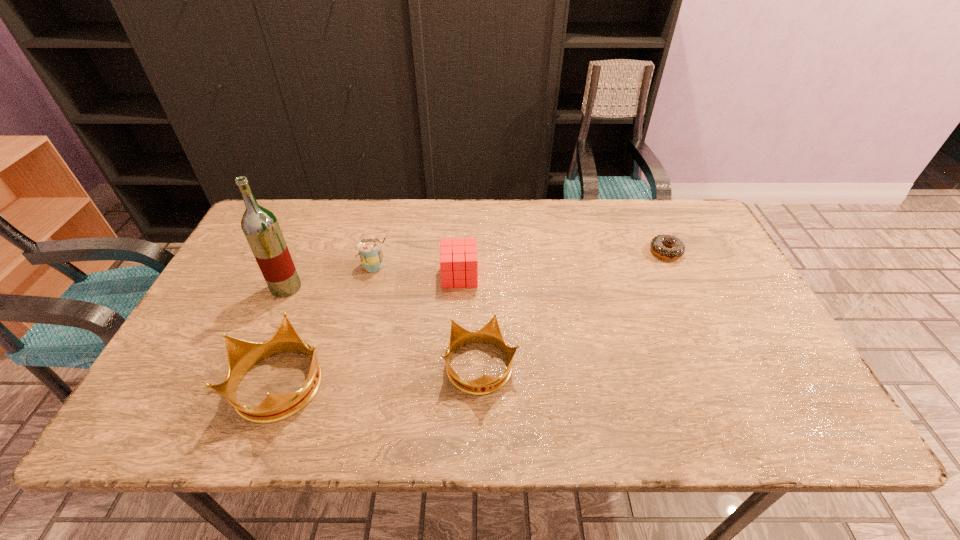
Find the location of a particular element. free space at the right edge of the desktop is located at coordinates (779, 349).

In the image, there is a desktop. Identify the location of vacant area at the far left corner. This screenshot has height=540, width=960. (298, 219).

Where is `free space at the near left corner of the desktop`? This screenshot has width=960, height=540. free space at the near left corner of the desktop is located at coordinates (190, 369).

I want to click on vacant space at the far right corner of the desktop, so click(x=687, y=209).

Locate an element on the screen. free space at the near right corner of the desktop is located at coordinates (761, 391).

You are a GUI agent. You are given a task and a screenshot of the screen. Output one action in this format:
    pyautogui.click(x=<x>, y=<y>)
    Task: Click on the vacant space that's between the doughnut and the shorter crown
    This screenshot has height=540, width=960.
    Given the screenshot: What is the action you would take?
    pyautogui.click(x=573, y=309)

You are a GUI agent. You are given a task and a screenshot of the screen. Output one action in this format:
    pyautogui.click(x=<x>, y=<y>)
    Task: Click on the vacant point located between the can and the rightmost object
    
    Given the screenshot: What is the action you would take?
    pyautogui.click(x=520, y=259)

What are the coordinates of `empty space between the left crown and the cube` in the screenshot? It's located at (371, 329).

Identify the location of vacant space that's between the shortest object and the right crown. The image size is (960, 540). (573, 309).

Where is `vacant point located between the cube and the taller crown`? The width and height of the screenshot is (960, 540). vacant point located between the cube and the taller crown is located at coordinates (371, 329).